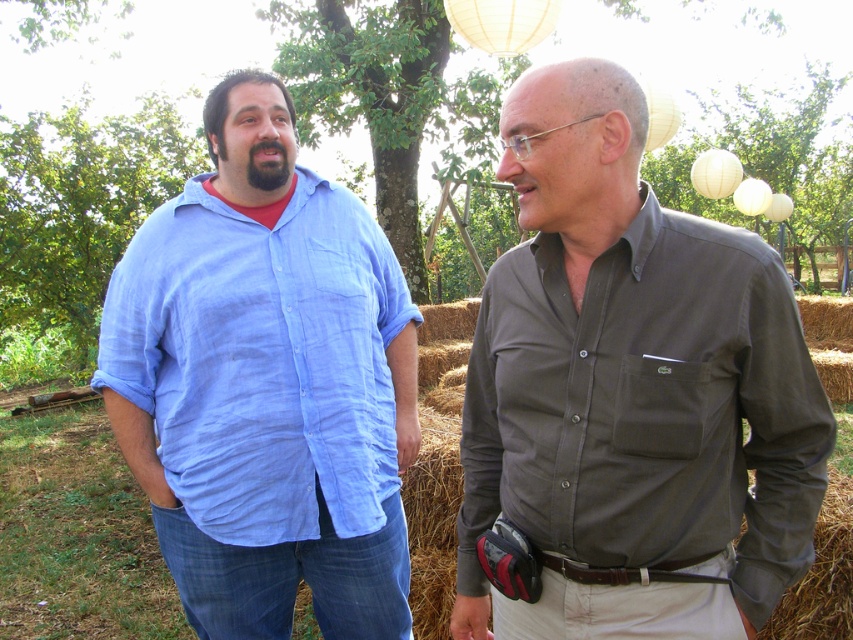
Does matte olive green shirt at center appear on the left side of matte blue shirt at left?

No, matte olive green shirt at center is not to the left of matte blue shirt at left.

Between point (608, 294) and point (300, 408), which one is positioned in front?

Point (608, 294)

Where is `matte olive green shirt at center`? Image resolution: width=853 pixels, height=640 pixels. matte olive green shirt at center is located at coordinates (631, 388).